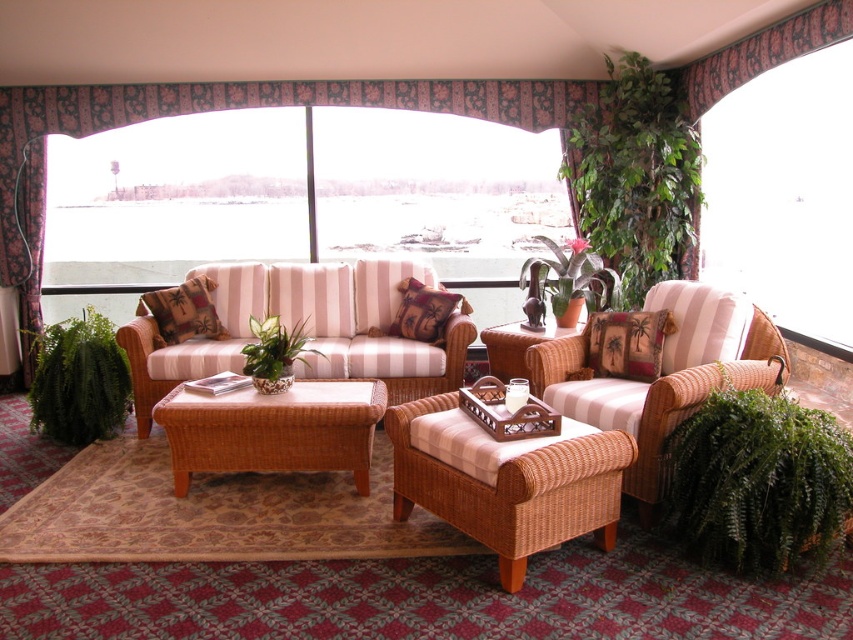
The width and height of the screenshot is (853, 640). I want to click on striped fabric couch at center, so click(x=306, y=328).

Does point (190, 276) come behind point (264, 413)?

Yes, it is behind point (264, 413).

You are a GUI agent. You are given a task and a screenshot of the screen. Output one action in this format:
    pyautogui.click(x=<x>, y=<y>)
    Task: Click on the striped fabric couch at center
    This screenshot has width=853, height=640.
    Given the screenshot: What is the action you would take?
    pyautogui.click(x=306, y=328)

Who is positioned more to the right, green leafy plant at upper right or green glossy plant at center?

From the viewer's perspective, green leafy plant at upper right appears more on the right side.

Can you confirm if green leafy plant at upper right is shorter than green glossy plant at center?

In fact, green leafy plant at upper right may be taller than green glossy plant at center.

Which is behind, point (618, 202) or point (294, 339)?

Positioned behind is point (618, 202).

Find the location of `green leafy plant at upper right`. green leafy plant at upper right is located at coordinates (635, 173).

Is green leafy plant at lower right to the right of palm-patterned fabric cushion at right from the viewer's perspective?

Yes, green leafy plant at lower right is to the right of palm-patterned fabric cushion at right.

Between green leafy plant at lower right and palm-patterned fabric cushion at right, which one has less height?

Standing shorter between the two is palm-patterned fabric cushion at right.

Locate an element on the screen. This screenshot has height=640, width=853. green leafy plant at lower right is located at coordinates (756, 480).